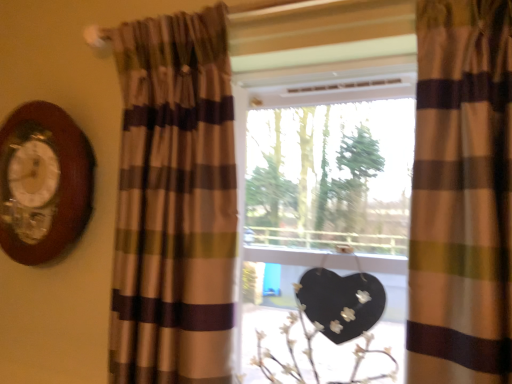
Question: From the image's perspective, is white matte floral arrangement at center on top of brown striped curtain at left, marked as the second curtain in a right-to-left arrangement?

Choices:
 (A) yes
 (B) no

Answer: (B)

Question: Are white matte floral arrangement at center and brown striped curtain at left, marked as the second curtain in a right-to-left arrangement, located far from each other?

Choices:
 (A) no
 (B) yes

Answer: (A)

Question: Considering the relative positions of white matte floral arrangement at center and brown striped curtain at left, marked as the second curtain in a right-to-left arrangement, in the image provided, is white matte floral arrangement at center in front of brown striped curtain at left, marked as the second curtain in a right-to-left arrangement,?

Choices:
 (A) yes
 (B) no

Answer: (B)

Question: Can you confirm if white matte floral arrangement at center is wider than brown striped curtain at left, which is the first curtain in left-to-right order?

Choices:
 (A) yes
 (B) no

Answer: (B)

Question: From the image's perspective, is white matte floral arrangement at center beneath brown striped curtain at left, marked as the second curtain in a right-to-left arrangement?

Choices:
 (A) yes
 (B) no

Answer: (A)

Question: Is matte glass window at center taller or shorter than white matte floral arrangement at center?

Choices:
 (A) short
 (B) tall

Answer: (B)

Question: From the image's perspective, relative to white matte floral arrangement at center, is matte glass window at center above or below?

Choices:
 (A) above
 (B) below

Answer: (A)

Question: Is point (312, 92) closer or farther from the camera than point (318, 375)?

Choices:
 (A) farther
 (B) closer

Answer: (A)

Question: In terms of width, does matte glass window at center look wider or thinner when compared to white matte floral arrangement at center?

Choices:
 (A) thin
 (B) wide

Answer: (B)

Question: From the image's perspective, is white matte floral arrangement at center positioned above or below matte glass window at center?

Choices:
 (A) above
 (B) below

Answer: (B)

Question: Is point (242, 352) closer or farther from the camera than point (390, 130)?

Choices:
 (A) closer
 (B) farther

Answer: (B)

Question: Is white matte floral arrangement at center to the left or to the right of matte glass window at center in the image?

Choices:
 (A) left
 (B) right

Answer: (B)

Question: Is white matte floral arrangement at center inside or outside of matte glass window at center?

Choices:
 (A) outside
 (B) inside

Answer: (B)

Question: From the image's perspective, is wooden clock at left located above or below white matte floral arrangement at center?

Choices:
 (A) below
 (B) above

Answer: (B)

Question: From a real-world perspective, is wooden clock at left positioned above or below white matte floral arrangement at center?

Choices:
 (A) above
 (B) below

Answer: (A)